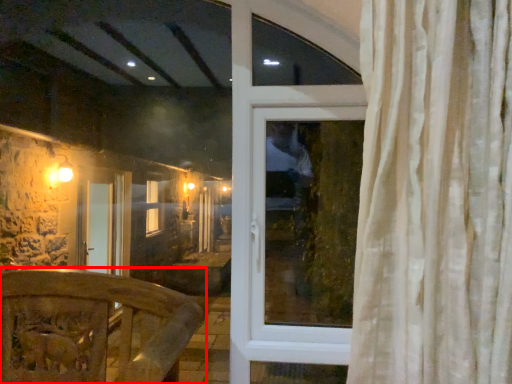
Question: Considering the relative positions of furniture (annotated by the red box) and window in the image provided, where is furniture (annotated by the red box) located with respect to the staircase?

Choices:
 (A) right
 (B) left

Answer: (B)